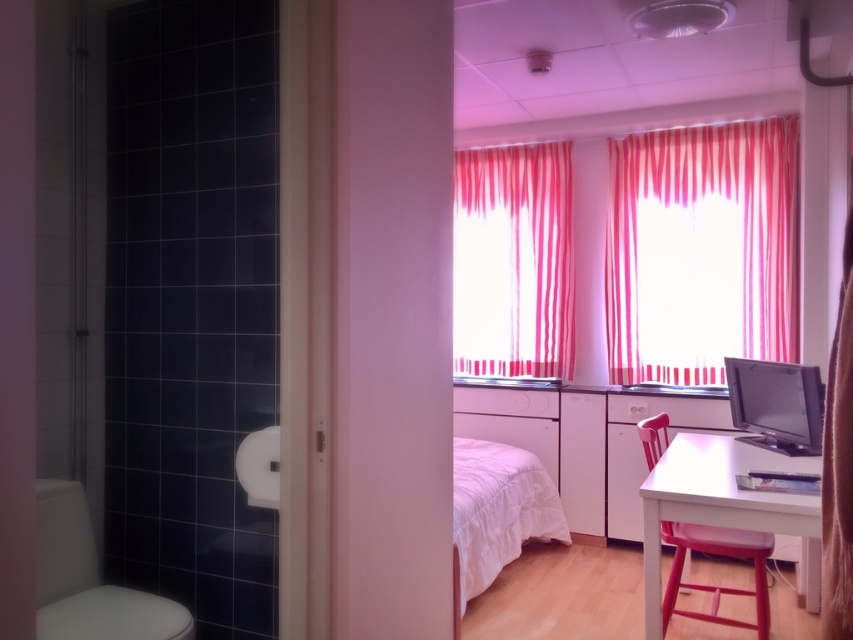
Question: Which is nearer to the pink striped curtain at upper right?

Choices:
 (A) white glossy table at lower right
 (B) matte black monitor at right
 (C) pink striped curtain at center
 (D) white glossy toilet bowl at lower left

Answer: (C)

Question: Does white glossy toilet bowl at lower left appear over white soft bed at center?

Choices:
 (A) no
 (B) yes

Answer: (B)

Question: Which object is the farthest from the pink striped curtain at center?

Choices:
 (A) pink striped curtain at upper right
 (B) white soft bed at center
 (C) matte black monitor at right

Answer: (C)

Question: Is white glossy toilet bowl at lower left wider than white soft bed at center?

Choices:
 (A) yes
 (B) no

Answer: (B)

Question: Which of the following is the closest to the observer?

Choices:
 (A) pink striped curtain at upper right
 (B) matte black monitor at right
 (C) pink striped curtain at center
 (D) white glossy table at lower right

Answer: (D)

Question: Is pink striped curtain at center to the left of matte black monitor at right from the viewer's perspective?

Choices:
 (A) yes
 (B) no

Answer: (A)